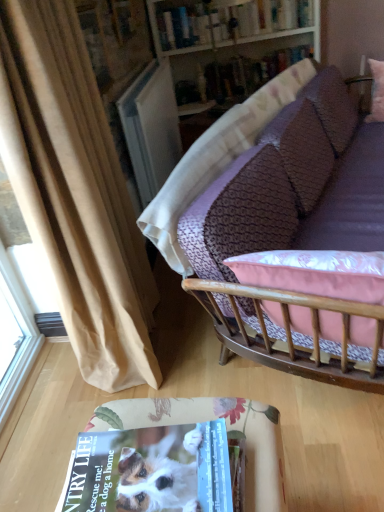
I want to click on purple fabric couch at upper right, so click(273, 205).

The image size is (384, 512). Describe the element at coordinates (232, 44) in the screenshot. I see `wooden bookshelf at upper center` at that location.

Where is `wooden bookshelf at upper center`? wooden bookshelf at upper center is located at coordinates (232, 44).

The height and width of the screenshot is (512, 384). Describe the element at coordinates (256, 71) in the screenshot. I see `hardcover book at upper center, which is counted as the second book, starting from the top` at that location.

The height and width of the screenshot is (512, 384). Describe the element at coordinates (177, 458) in the screenshot. I see `floral fabric table at lower center` at that location.

The image size is (384, 512). What do you see at coordinates (75, 192) in the screenshot?
I see `beige fabric curtain at left` at bounding box center [75, 192].

You are a GUI agent. You are given a task and a screenshot of the screen. Output one action in this format:
    pyautogui.click(x=<x>, y=<y>)
    Task: Click on the purple fabric couch at upper right
    This screenshot has height=512, width=384.
    Given the screenshot: What is the action you would take?
    pos(273,205)

What's the angular difference between hardcover book at upper center, which is counted as the second book, starting from the top, and beige fabric curtain at left's facing directions?

hardcover book at upper center, which is counted as the second book, starting from the top, and beige fabric curtain at left are facing 85.8 degrees away from each other.

Which is correct: hardcover book at upper center, the 1th book from the bottom, is inside beige fabric curtain at left, or outside of it?

hardcover book at upper center, the 1th book from the bottom, is located beyond the bounds of beige fabric curtain at left.

Consider the image. From the image's perspective, is hardcover book at upper center, which is counted as the second book, starting from the top, located above or below beige fabric curtain at left?

Clearly, from the image's perspective, hardcover book at upper center, which is counted as the second book, starting from the top, is above beige fabric curtain at left.

Is purple fabric couch at upper right far away from floral fabric table at lower center?

No, purple fabric couch at upper right is not far away from floral fabric table at lower center.

Find the location of a particular element. The image size is (384, 512). studio couch behind the floral fabric table at lower center is located at coordinates point(273,205).

Can you confirm if purple fabric couch at upper right is thinner than floral fabric table at lower center?

No.

Is purple fabric couch at upper right shorter than hardcover book at upper center, positioned as the 1th book in top-to-bottom order?

No, purple fabric couch at upper right is not shorter than hardcover book at upper center, positioned as the 1th book in top-to-bottom order.

Does purple fabric couch at upper right lie behind hardcover book at upper center, which is counted as the second book, starting from the bottom?

No, purple fabric couch at upper right is closer to the viewer.

Would you say purple fabric couch at upper right is outside hardcover book at upper center, which is counted as the second book, starting from the bottom?

Absolutely, purple fabric couch at upper right is external to hardcover book at upper center, which is counted as the second book, starting from the bottom.

Does purple fabric couch at upper right have a lesser width compared to hardcover book at upper center, which is counted as the second book, starting from the bottom?

In fact, purple fabric couch at upper right might be wider than hardcover book at upper center, which is counted as the second book, starting from the bottom.

Is the position of wooden bookshelf at upper center more distant than that of floral fabric table at lower center?

Yes, wooden bookshelf at upper center is behind floral fabric table at lower center.

Can you confirm if wooden bookshelf at upper center is positioned to the right of floral fabric table at lower center?

Yes.

Considering the sizes of objects wooden bookshelf at upper center and floral fabric table at lower center in the image provided, who is wider, wooden bookshelf at upper center or floral fabric table at lower center?

With larger width is wooden bookshelf at upper center.

In terms of height, does purple fabric couch at upper right look taller or shorter compared to beige fabric curtain at left?

purple fabric couch at upper right is shorter than beige fabric curtain at left.

Considering the positions of objects purple fabric couch at upper right and beige fabric curtain at left in the image provided, who is more to the left, purple fabric couch at upper right or beige fabric curtain at left?

beige fabric curtain at left.

From the picture: From the image's perspective, which object appears higher, purple fabric couch at upper right or beige fabric curtain at left?

From the image's view, purple fabric couch at upper right is above.

Is point (243, 349) more distant than point (62, 269)?

No, (243, 349) is closer to viewer.

Is hardcover book at upper center, which is counted as the second book, starting from the bottom, situated inside hardcover book at upper center, the 1th book from the bottom, or outside?

hardcover book at upper center, which is counted as the second book, starting from the bottom, lies outside hardcover book at upper center, the 1th book from the bottom.

Does hardcover book at upper center, positioned as the 1th book in top-to-bottom order, lie behind hardcover book at upper center, the 1th book from the bottom?

That is False.

This screenshot has height=512, width=384. Find the location of `book above the hardcover book at upper center, which is counted as the second book, starting from the top (from a real-world perspective)`. book above the hardcover book at upper center, which is counted as the second book, starting from the top (from a real-world perspective) is located at coordinates [x=186, y=27].

Is wooden bookshelf at upper center bigger or smaller than hardcover book at upper center, positioned as the 1th book in top-to-bottom order?

In the image, wooden bookshelf at upper center appears to be larger than hardcover book at upper center, positioned as the 1th book in top-to-bottom order.

Can you confirm if wooden bookshelf at upper center is thinner than hardcover book at upper center, which is counted as the second book, starting from the bottom?

No.

Between wooden bookshelf at upper center and hardcover book at upper center, positioned as the 1th book in top-to-bottom order, which one is positioned in front?

Positioned in front is wooden bookshelf at upper center.

Based on the photo, from a real-world perspective, is wooden bookshelf at upper center positioned over hardcover book at upper center, which is counted as the second book, starting from the bottom, based on gravity?

Incorrect, from a real-world perspective, wooden bookshelf at upper center is lower than hardcover book at upper center, which is counted as the second book, starting from the bottom.

Identify the location of book that appears below the beige fabric curtain at left (from a real-world perspective). (256, 71).

Locate an element on the screen. The width and height of the screenshot is (384, 512). table above the purple fabric couch at upper right (from a real-world perspective) is located at coordinates (177, 458).

From the image, which object appears to be farther from floral fabric table at lower center, beige fabric curtain at left or hardcover book at upper center, which is counted as the second book, starting from the top?

hardcover book at upper center, which is counted as the second book, starting from the top, is further to floral fabric table at lower center.

Looking at the image, which one is located closer to floral fabric table at lower center, hardcover book at upper center, positioned as the 1th book in top-to-bottom order, or purple fabric couch at upper right?

purple fabric couch at upper right is positioned closer to the anchor floral fabric table at lower center.

Which object lies further to the anchor point hardcover book at upper center, the 1th book from the bottom, floral fabric table at lower center or wooden bookshelf at upper center?

floral fabric table at lower center lies further to hardcover book at upper center, the 1th book from the bottom, than the other object.

Estimate the real-world distances between objects in this image. Which object is closer to hardcover book at upper center, positioned as the 1th book in top-to-bottom order, floral fabric table at lower center or hardcover book at upper center, the 1th book from the bottom?

Based on the image, hardcover book at upper center, the 1th book from the bottom, appears to be nearer to hardcover book at upper center, positioned as the 1th book in top-to-bottom order.

Looking at the image, which one is located closer to hardcover book at upper center, positioned as the 1th book in top-to-bottom order, purple fabric couch at upper right or hardcover book at upper center, which is counted as the second book, starting from the top?

hardcover book at upper center, which is counted as the second book, starting from the top, is closer to hardcover book at upper center, positioned as the 1th book in top-to-bottom order.

Based on their spatial positions, is hardcover book at upper center, which is counted as the second book, starting from the bottom, or wooden bookshelf at upper center further from floral fabric table at lower center?

hardcover book at upper center, which is counted as the second book, starting from the bottom, is further to floral fabric table at lower center.

Estimate the real-world distances between objects in this image. Which object is closer to wooden bookshelf at upper center, purple fabric couch at upper right or hardcover book at upper center, the 1th book from the bottom?

The object closer to wooden bookshelf at upper center is hardcover book at upper center, the 1th book from the bottom.

Which object lies further to the anchor point beige fabric curtain at left, wooden bookshelf at upper center or hardcover book at upper center, which is counted as the second book, starting from the bottom?

The object further to beige fabric curtain at left is hardcover book at upper center, which is counted as the second book, starting from the bottom.

At what (x,y) coordinates should I click in order to perform the action: click on studio couch between floral fabric table at lower center and hardcover book at upper center, positioned as the 1th book in top-to-bottom order, along the z-axis. Please return your answer as a coordinate pair (x, y). The height and width of the screenshot is (512, 384). Looking at the image, I should click on (273, 205).

Locate an element on the screen. The width and height of the screenshot is (384, 512). curtain between purple fabric couch at upper right and wooden bookshelf at upper center in the front-back direction is located at coordinates (75, 192).

In order to click on bookshelf located between floral fabric table at lower center and hardcover book at upper center, which is counted as the second book, starting from the bottom, in the depth direction in this screenshot , I will do `click(232, 44)`.

Find the location of a particular element. book between beige fabric curtain at left and hardcover book at upper center, the 1th book from the bottom, from front to back is located at coordinates (186, 27).